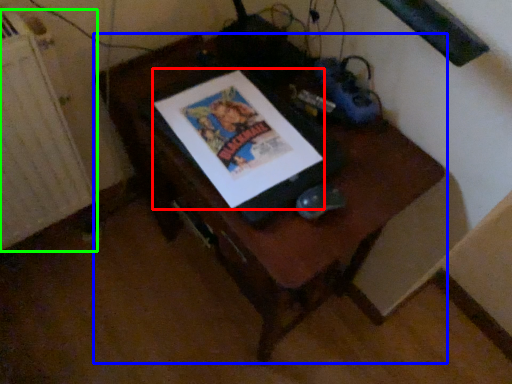
Question: Considering the real-world distances, which object is farthest from comic book (highlighted by a red box)? furniture (highlighted by a blue box) or radiator (highlighted by a green box)?

Choices:
 (A) furniture
 (B) radiator

Answer: (B)